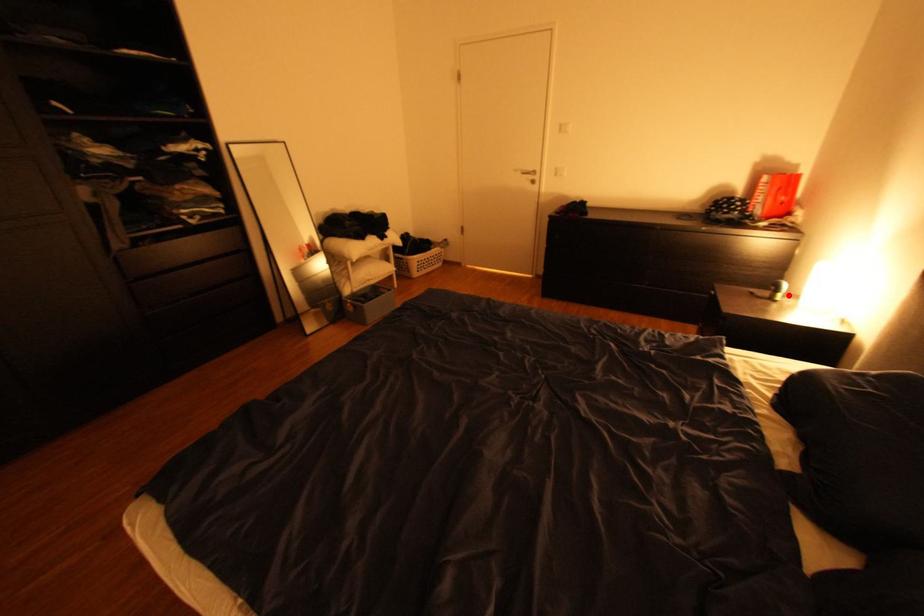
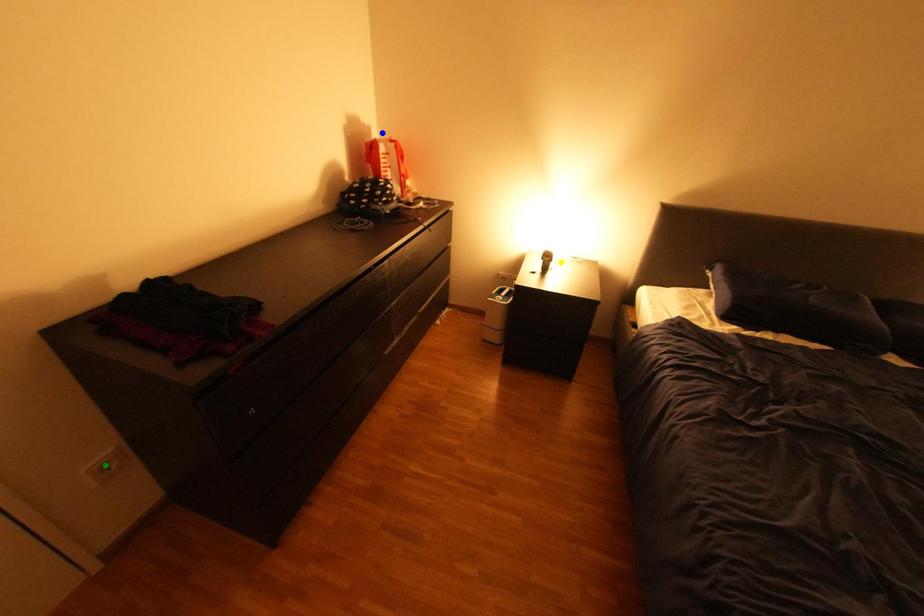
Question: I am providing you with two images of the same scene from different viewpoints. A red point is marked on the first image. You are given multiple points on the second image. Which mark in image 2 goes with the point in image 1?

Choices:
 (A) blue point
 (B) green point
 (C) yellow point

Answer: (C)